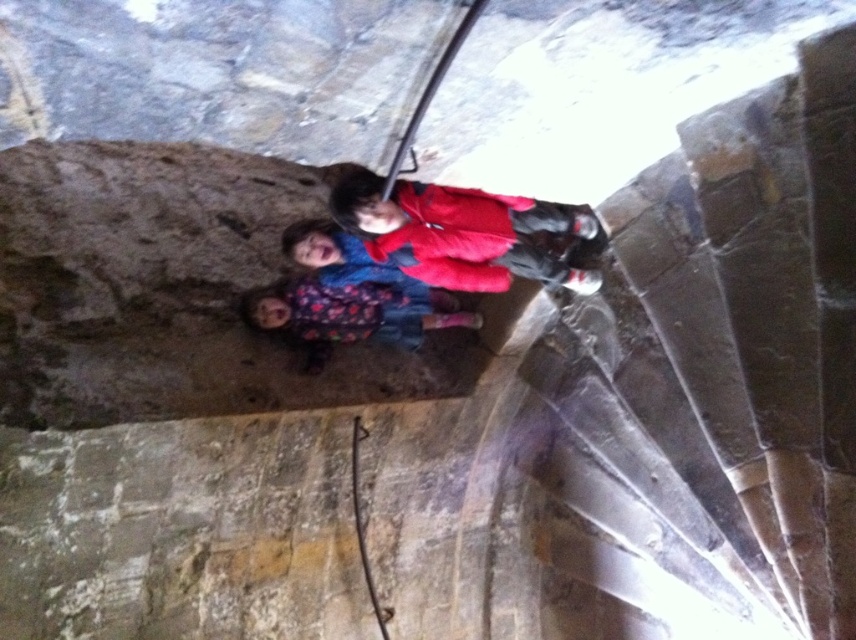
Question: Which point appears closest to the camera in this image?

Choices:
 (A) (310, 333)
 (B) (479, 241)

Answer: (B)

Question: Does matte red jacket at center appear on the left side of floral-patterned fabric at center?

Choices:
 (A) no
 (B) yes

Answer: (A)

Question: Which point is closer to the camera?

Choices:
 (A) floral-patterned fabric at center
 (B) matte red jacket at center

Answer: (B)

Question: Is matte red jacket at center bigger than floral-patterned fabric at center?

Choices:
 (A) no
 (B) yes

Answer: (B)

Question: Among these points, which one is farthest from the camera?

Choices:
 (A) (334, 324)
 (B) (516, 253)

Answer: (A)

Question: Does matte red jacket at center have a larger size compared to floral-patterned fabric at center?

Choices:
 (A) yes
 (B) no

Answer: (A)